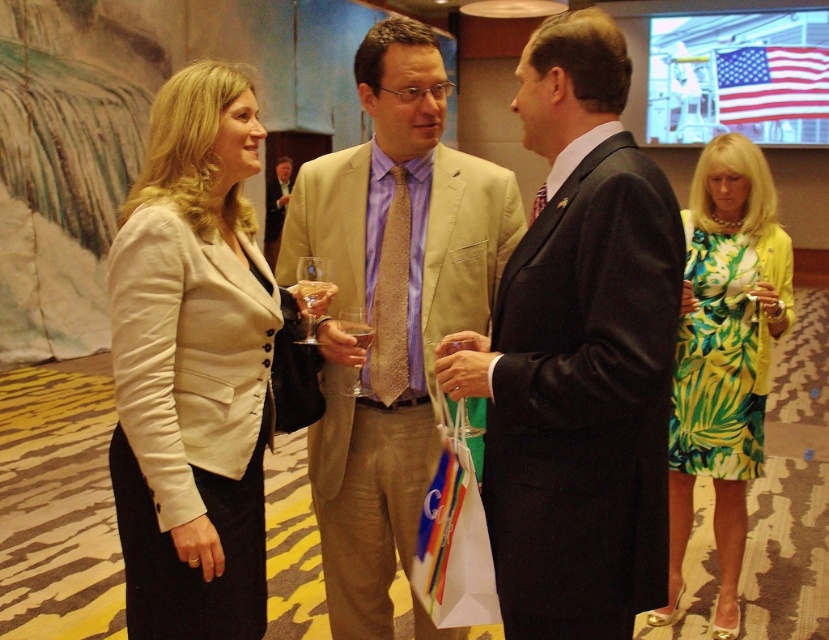
You are at a formal event and notice two items worn by the man in the center. The items are the light beige suit at center and the satin gold tie at center. Which item is positioned to the left of the other?

The light beige suit at center is to the left of the satin gold tie at center.